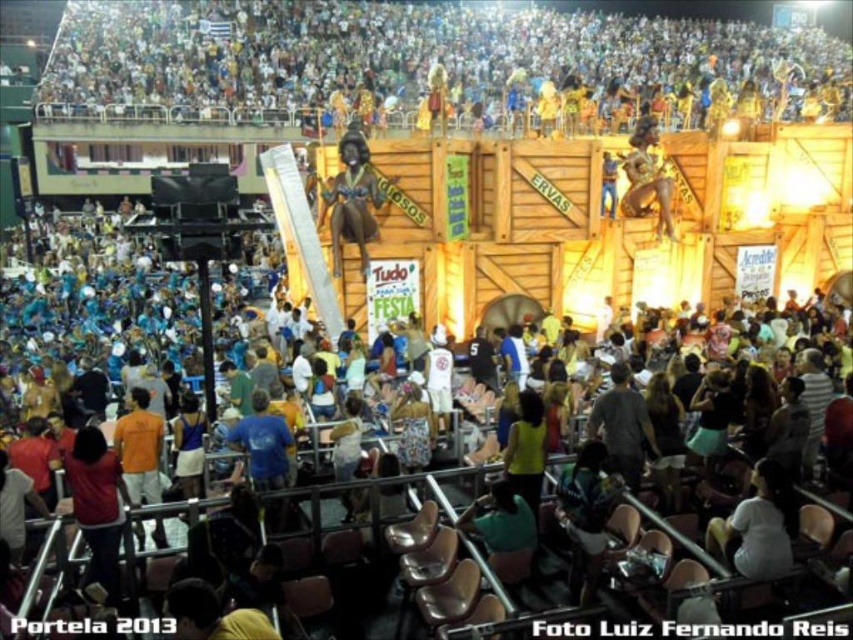
Can you confirm if white plastic chairs at upper center is shorter than green matte shirt at lower center?

In fact, white plastic chairs at upper center may be taller than green matte shirt at lower center.

Does point (370, 44) lie behind point (492, 502)?

Yes, it is.

Is point (693, 44) farther from camera compared to point (531, 520)?

Yes, point (693, 44) is farther from viewer.

You are a GUI agent. You are given a task and a screenshot of the screen. Output one action in this format:
    pyautogui.click(x=<x>, y=<y>)
    Task: Click on the white plastic chairs at upper center
    Image resolution: width=853 pixels, height=640 pixels.
    Given the screenshot: What is the action you would take?
    pyautogui.click(x=399, y=54)

Image resolution: width=853 pixels, height=640 pixels. Describe the element at coordinates (399, 54) in the screenshot. I see `white plastic chairs at upper center` at that location.

Can you confirm if white plastic chairs at upper center is thinner than shiny gold statue at center?

No.

This screenshot has width=853, height=640. I want to click on white plastic chairs at upper center, so click(399, 54).

Does white matte shirt at lower right appear on the left side of shiny gold statue at center?

No, white matte shirt at lower right is not to the left of shiny gold statue at center.

Between point (778, 518) and point (360, 237), which one is positioned behind?

The point (360, 237) is behind.

The height and width of the screenshot is (640, 853). What are the coordinates of `white matte shirt at lower right` in the screenshot? It's located at (761, 525).

The image size is (853, 640). I want to click on white matte shirt at lower right, so click(761, 525).